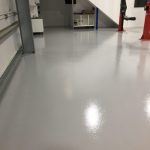
At what (x,y) coordinates should I click in order to perform the action: click on side of table. Please return your answer as a coordinate pair (x, y). This screenshot has height=150, width=150. Looking at the image, I should click on (38, 25).